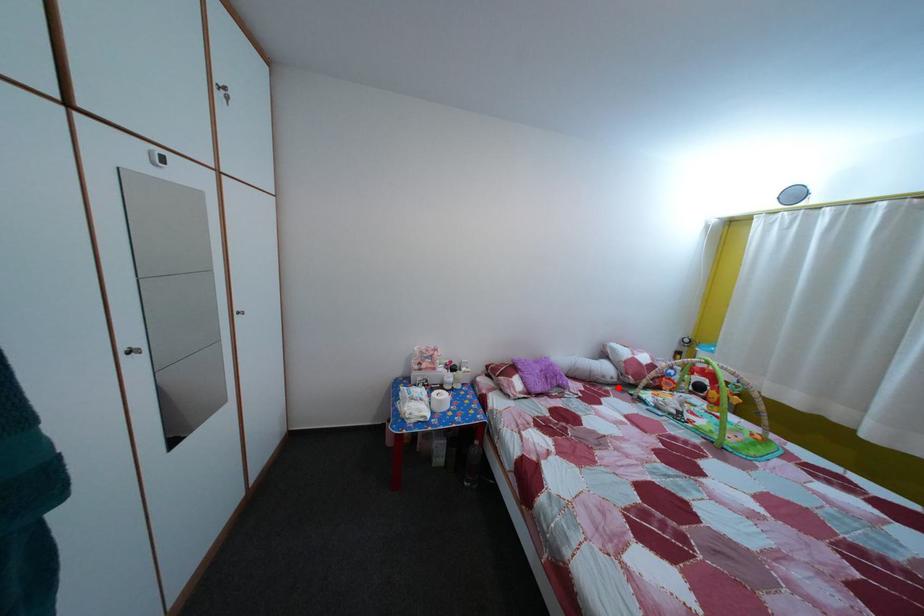
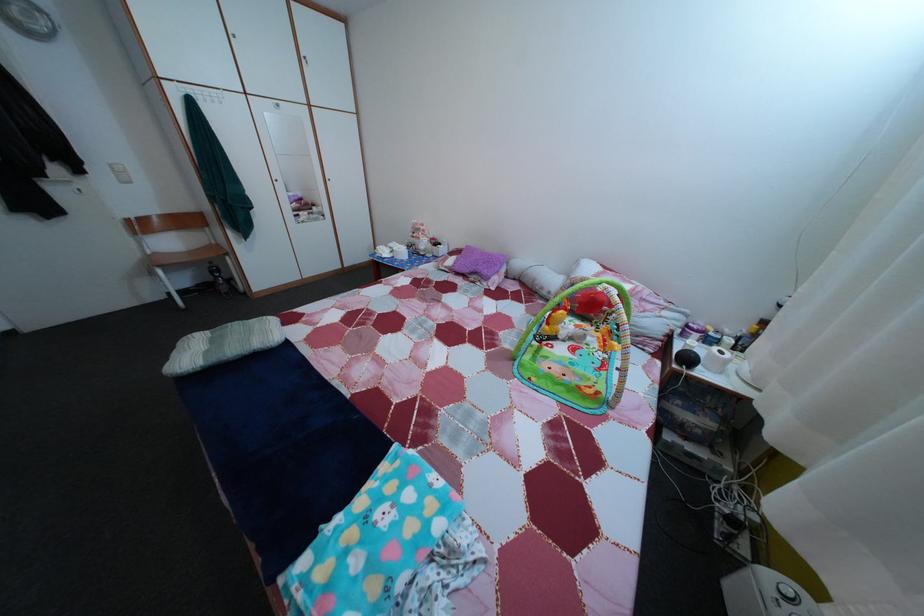
The point at the highlighted location is marked in the first image. Where is the corresponding point in the second image?

(553, 301)